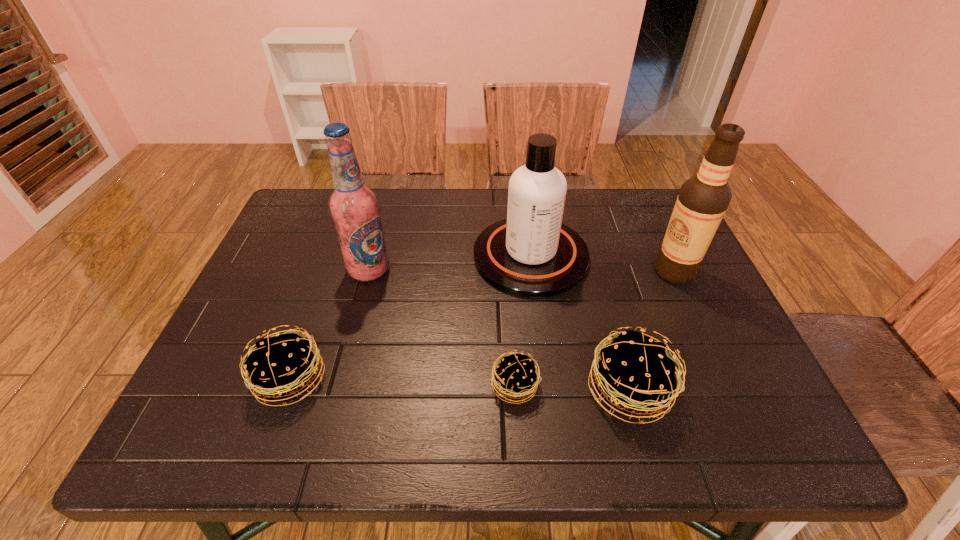
You are a GUI agent. You are given a task and a screenshot of the screen. Output one action in this format:
    pyautogui.click(x=<x>, y=<y>)
    Task: Click on the vacant space at the far edge of the desktop
    This screenshot has height=540, width=960.
    Given the screenshot: What is the action you would take?
    pyautogui.click(x=391, y=226)

Locate an element on the screen. This screenshot has width=960, height=540. vacant area at the near edge is located at coordinates (379, 386).

Find the location of `vacant space at the right edge of the desktop`. vacant space at the right edge of the desktop is located at coordinates (654, 293).

The height and width of the screenshot is (540, 960). Identify the location of blank space at the far left corner. (293, 203).

What are the coordinates of `free space at the far right corner of the desktop` in the screenshot? It's located at [x=646, y=226].

This screenshot has height=540, width=960. In order to click on vacant area at the near right corner of the desktop in this screenshot , I will do (x=698, y=380).

This screenshot has width=960, height=540. What are the coordinates of `empty location between the rightmost patty and the cleansing agent` in the screenshot? It's located at (580, 323).

I want to click on empty space that is in between the second shortest patty and the cleansing agent, so click(411, 318).

Find the location of a particular element. unoccupied area between the second patty from left to right and the rightmost patty is located at coordinates (572, 388).

This screenshot has width=960, height=540. Find the location of `blank region between the rightmost object and the second shortest object`. blank region between the rightmost object and the second shortest object is located at coordinates (483, 325).